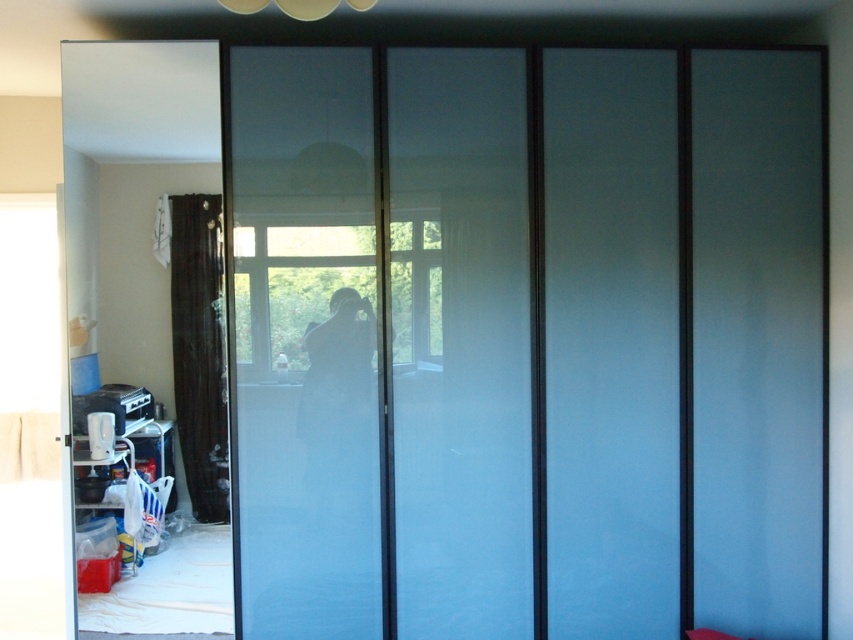
You are standing in the room and want to move from the frosted glass door at center to the brown velvet curtain at left. Which direction should you move to get closer to the curtain?

Since the frosted glass door at center is further to the viewer than the brown velvet curtain at left, you should move backward to get closer to the brown velvet curtain at left.

You are standing in the room and want to move from the frosted glass door at center to the brown velvet curtain at left. Which direction should you move?

Since the frosted glass door at center is positioned on the right side of brown velvet curtain at left, you should move to the left to reach the brown velvet curtain at left from the frosted glass door at center.

In the scene shown: You are trying to determine which object is taller between the frosted glass door at center and the brown velvet curtain at left. Based on the scene description, which one is taller?

The frosted glass door at center is taller than the brown velvet curtain at left according to the description.